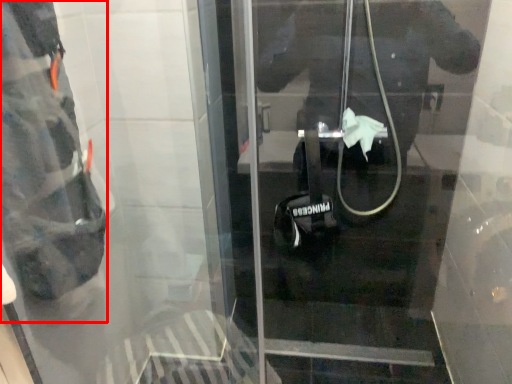
Question: In this image, where is wide (annotated by the red box) located relative to door?

Choices:
 (A) left
 (B) right

Answer: (A)